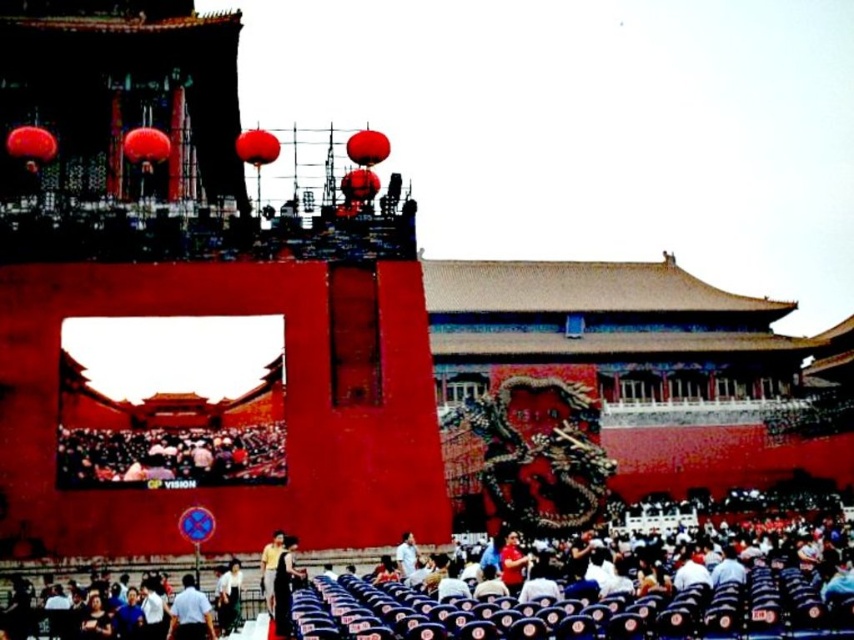
You are standing in the crowd at the event and want to take a photo of both the dragon motif on the large red wall and the live screen. You notice two points marked in the image. Which point is closer to you, point (847, 584) or point (265, 608)?

Point (847, 584) is closer to the viewer than point (265, 608).

From the picture: You are standing at the point marked as point (610, 589) in the image. Looking around, you see dark blue fabric seats at lower center. What object is located at your current position?

The dark blue fabric seats at lower center are located at point (610, 589).

You are standing in the crowd at the event and want to know which of the two points, point (615, 566) or point (110, 451), is closer to you. Which one is closer?

Point (110, 451) is closer to you because it is less further to the viewer than point (615, 566).